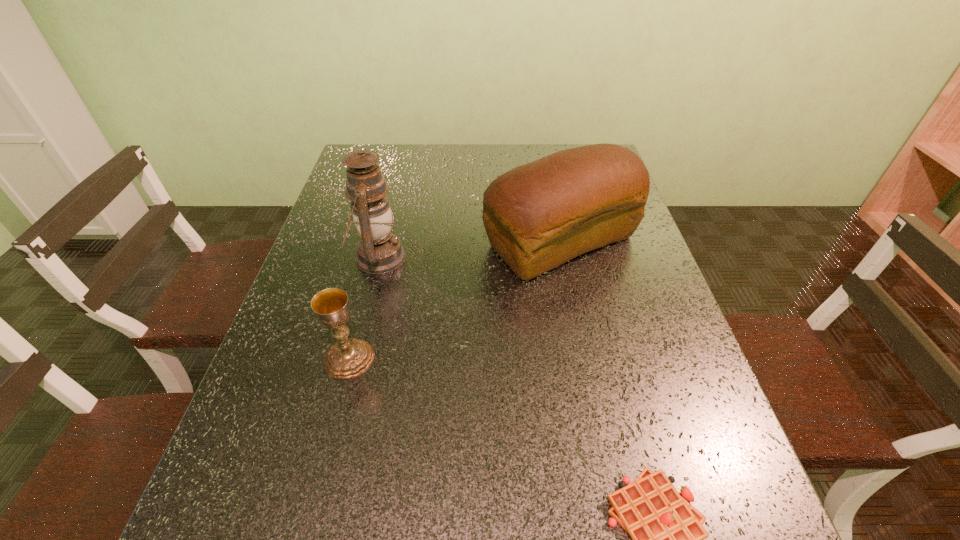
Where is `oil lamp`? oil lamp is located at coordinates (379, 251).

Identify the location of bread. The width and height of the screenshot is (960, 540). (x=537, y=216).

Where is `chalice`? chalice is located at coordinates (347, 358).

Where is `the second nearest object`? This screenshot has height=540, width=960. the second nearest object is located at coordinates (347, 358).

This screenshot has height=540, width=960. I want to click on free spot located on the right of the tallest object, so click(489, 258).

The width and height of the screenshot is (960, 540). What are the coordinates of `blank area located on the back of the bread` in the screenshot? It's located at (546, 174).

This screenshot has width=960, height=540. I want to click on blank space located 0.310m on the back of the chalice, so click(378, 244).

The width and height of the screenshot is (960, 540). In order to click on oil lamp present at the left edge in this screenshot , I will do `click(379, 251)`.

Where is `chalice situated at the left edge`? chalice situated at the left edge is located at coordinates (347, 358).

The height and width of the screenshot is (540, 960). I want to click on object present at the right edge, so click(537, 216).